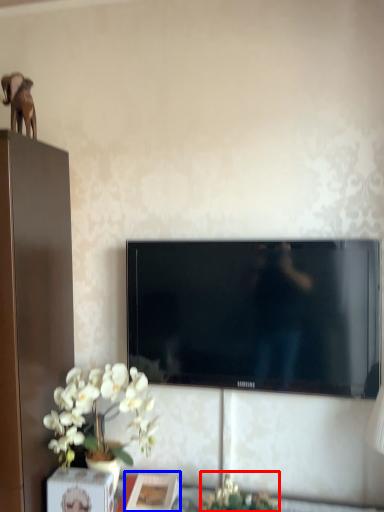
Question: Among these objects, which one is farthest to the camera, plant (highlighted by a red box) or picture frame (highlighted by a blue box)?

Choices:
 (A) plant
 (B) picture frame

Answer: (B)